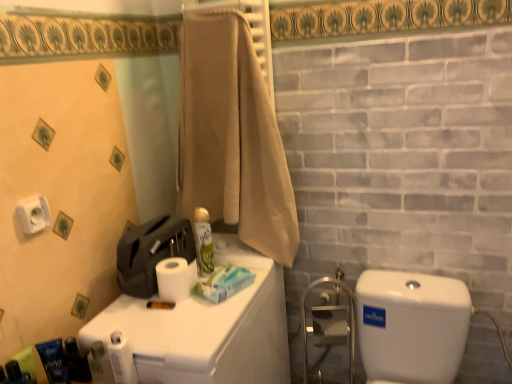
The image size is (512, 384). Identify the location of blue matte tube at lower left, the fourth toiletry from the right. (26, 361).

Where is `white plastic toilet tank at center`? This screenshot has height=384, width=512. white plastic toilet tank at center is located at coordinates (207, 330).

In order to click on white glossy water tank at right in this screenshot , I will do `click(411, 326)`.

Locate an element on the screen. white matte toilet paper at left, the 1th toilet paper when ordered from left to right is located at coordinates (x=34, y=215).

What do you see at coordinates (203, 242) in the screenshot? This screenshot has height=384, width=512. I see `green matte spray can at center, positioned as the fifth toiletry in front-to-back order` at bounding box center [203, 242].

The image size is (512, 384). Find the location of `blue matte tube at lower left, which is the 2th toiletry in left-to-right order`. blue matte tube at lower left, which is the 2th toiletry in left-to-right order is located at coordinates (26, 361).

From the image's perspective, which is below, blue matte tube at lower left, which is the 2th toiletry in left-to-right order, or white glossy water tank at right?

From the image's view, white glossy water tank at right is below.

Is blue matte tube at lower left, the 4th toiletry from the back, smaller than white glossy water tank at right?

Correct, blue matte tube at lower left, the 4th toiletry from the back, occupies less space than white glossy water tank at right.

The width and height of the screenshot is (512, 384). Find the location of `toiletry that is the 4th object to the left of the white glossy water tank at right, starting at the anchor`. toiletry that is the 4th object to the left of the white glossy water tank at right, starting at the anchor is located at coordinates (26, 361).

Can you tell me how much blue matte tube at lower left, the 4th toiletry from the back, and white glossy water tank at right differ in facing direction?

The angular difference between blue matte tube at lower left, the 4th toiletry from the back, and white glossy water tank at right is 89.4 degrees.

Is white glossy water tank at right at the right side of blue matte toiletry at lower left, acting as the third toiletry starting from the left?

Yes, white glossy water tank at right is to the right of blue matte toiletry at lower left, acting as the third toiletry starting from the left.

Looking at this image, what's the angular difference between white glossy water tank at right and blue matte toiletry at lower left, placed as the 3th toiletry when sorted from back to front,'s facing directions?

36.6 degrees.

From the image's perspective, would you say white glossy water tank at right is positioned over blue matte toiletry at lower left, placed as the 3th toiletry when sorted from back to front?

No, from the image's perspective, white glossy water tank at right is not on top of blue matte toiletry at lower left, placed as the 3th toiletry when sorted from back to front.

Could blue matte toiletry at lower left, placed as the 3th toiletry when sorted from back to front, be considered to be inside white glossy water tank at right?

No, blue matte toiletry at lower left, placed as the 3th toiletry when sorted from back to front, is not surrounded by white glossy water tank at right.

Are white matte toilet paper at lower left, placed as the second toilet paper when sorted from right to left, and metallic blue soap dispenser at lower left, the fourth toiletry in the left-to-right sequence, far apart?

No, there isn't a large distance between white matte toilet paper at lower left, placed as the second toilet paper when sorted from right to left, and metallic blue soap dispenser at lower left, the fourth toiletry in the left-to-right sequence.

Looking at this image, from a real-world perspective, is white matte toilet paper at lower left, the first toilet paper from the bottom, on top of metallic blue soap dispenser at lower left, the 2th toiletry when ordered from right to left?

Yes.

Is point (118, 339) in front of point (78, 379)?

Yes, it is.

Could you tell me if white matte toilet paper at left, the 2th toilet paper in the back-to-front sequence, is turned towards white matte toilet paper at upper center, which is the first toilet paper in right-to-left order?

No.

Which object is closer to the camera taking this photo, white matte toilet paper at left, arranged as the 3th toilet paper when ordered from the bottom, or white matte toilet paper at upper center, which appears as the third toilet paper when viewed from the front?

white matte toilet paper at left, arranged as the 3th toilet paper when ordered from the bottom, is in front.

From a real-world perspective, which object rests below the other?

In real-world perspective, white matte toilet paper at upper center, which appears as the third toilet paper when viewed from the front, is lower.

From the white matte toilet paper at upper center, placed as the second toilet paper when sorted from top to bottom, count 1st toilet papers forward and point to it. Please provide its 2D coordinates.

[(34, 215)]

Considering the sizes of objects blue matte tube at lower left, the fourth toiletry from the right, and blue matte toiletry at lower left, the 3th toiletry positioned from the front, in the image provided, who is shorter, blue matte tube at lower left, the fourth toiletry from the right, or blue matte toiletry at lower left, the 3th toiletry positioned from the front,?

blue matte tube at lower left, the fourth toiletry from the right, is shorter.

Between blue matte tube at lower left, positioned as the second toiletry in front-to-back order, and blue matte toiletry at lower left, the third toiletry when ordered from right to left, which one appears on the left side from the viewer's perspective?

blue matte tube at lower left, positioned as the second toiletry in front-to-back order.

Can you confirm if blue matte tube at lower left, positioned as the second toiletry in front-to-back order, is wider than blue matte toiletry at lower left, the third toiletry when ordered from right to left?

In fact, blue matte tube at lower left, positioned as the second toiletry in front-to-back order, might be narrower than blue matte toiletry at lower left, the third toiletry when ordered from right to left.

Choose the correct answer: Is blue matte tube at lower left, positioned as the second toiletry in front-to-back order, inside blue matte toiletry at lower left, placed as the 3th toiletry when sorted from back to front, or outside it?

blue matte tube at lower left, positioned as the second toiletry in front-to-back order, is outside blue matte toiletry at lower left, placed as the 3th toiletry when sorted from back to front.

In the scene shown: Considering the relative sizes of blue matte tube at lower left, positioned as the second toiletry in front-to-back order, and black plastic razor at lower left, the fifth toiletry positioned from the right, in the image provided, is blue matte tube at lower left, positioned as the second toiletry in front-to-back order, wider than black plastic razor at lower left, the fifth toiletry positioned from the right,?

Yes.

Between point (19, 366) and point (15, 383), which one is positioned in front?

Positioned in front is point (15, 383).

Is blue matte tube at lower left, the 4th toiletry from the back, not close to black plastic razor at lower left, marked as the 5th toiletry in a back-to-front arrangement?

No, there isn't a large distance between blue matte tube at lower left, the 4th toiletry from the back, and black plastic razor at lower left, marked as the 5th toiletry in a back-to-front arrangement.

Does white matte toilet paper at lower left, arranged as the third toilet paper when viewed from the back, appear on the left side of white plastic toilet tank at center?

Indeed, white matte toilet paper at lower left, arranged as the third toilet paper when viewed from the back, is positioned on the left side of white plastic toilet tank at center.

In terms of height, does white matte toilet paper at lower left, positioned as the second toilet paper in left-to-right order, look taller or shorter compared to white plastic toilet tank at center?

Considering their sizes, white matte toilet paper at lower left, positioned as the second toilet paper in left-to-right order, has less height than white plastic toilet tank at center.

From a real-world perspective, who is located higher, white matte toilet paper at lower left, placed as the second toilet paper when sorted from right to left, or white plastic toilet tank at center?

white matte toilet paper at lower left, placed as the second toilet paper when sorted from right to left.

Image resolution: width=512 pixels, height=384 pixels. In order to click on water tank below the blue matte tube at lower left, the 4th toiletry from the back (from the image's perspective) in this screenshot , I will do `click(411, 326)`.

In order to click on toiletry that is the 4th one above the white glossy water tank at right (from a real-world perspective) in this screenshot , I will do `click(54, 361)`.

Which object lies nearer to the anchor point beige cotton towel at upper center, blue matte tube at lower left, positioned as the second toiletry in front-to-back order, or white glossy water tank at right?

Based on the image, white glossy water tank at right appears to be nearer to beige cotton towel at upper center.

Which object lies further to the anchor point beige cotton towel at upper center, white matte toilet paper at upper center, which is the first toilet paper in right-to-left order, or green matte spray can at center, placed as the first toiletry when sorted from back to front?

white matte toilet paper at upper center, which is the first toilet paper in right-to-left order, is positioned further to the anchor beige cotton towel at upper center.

When comparing their distances from white matte toilet paper at upper center, which appears as the third toilet paper when viewed from the front, does white glossy water tank at right or black plastic razor at lower left, acting as the 1th toiletry starting from the front, seem further?

white glossy water tank at right.

Based on their spatial positions, is black plastic razor at lower left, acting as the 1th toiletry starting from the front, or green matte spray can at center, the fifth toiletry when ordered from left to right, closer to white matte toilet paper at lower left, arranged as the third toilet paper when viewed from the back?

black plastic razor at lower left, acting as the 1th toiletry starting from the front.

Considering their positions, is beige cotton towel at upper center positioned closer to white matte toilet paper at upper center, which is the first toilet paper in right-to-left order, than white plastic toilet tank at center?

The object closer to white matte toilet paper at upper center, which is the first toilet paper in right-to-left order, is white plastic toilet tank at center.

Looking at the image, which one is located closer to white matte toilet paper at lower left, the first toilet paper from the bottom, white glossy water tank at right or white matte toilet paper at upper center, positioned as the third toilet paper in left-to-right order?

The object closer to white matte toilet paper at lower left, the first toilet paper from the bottom, is white matte toilet paper at upper center, positioned as the third toilet paper in left-to-right order.

Based on their spatial positions, is black plastic razor at lower left, marked as the 5th toiletry in a back-to-front arrangement, or white matte toilet paper at upper center, positioned as the third toilet paper in left-to-right order, closer to white matte toilet paper at left, marked as the second toilet paper in a front-to-back arrangement?

black plastic razor at lower left, marked as the 5th toiletry in a back-to-front arrangement.

Looking at the image, which one is located closer to white matte toilet paper at upper center, which appears as the third toilet paper when viewed from the front, beige cotton towel at upper center or blue matte toiletry at lower left, the third toiletry when ordered from right to left?

blue matte toiletry at lower left, the third toiletry when ordered from right to left.

Where is `bath towel situated between black plastic razor at lower left, acting as the 1th toiletry starting from the front, and white glossy water tank at right from left to right`? The height and width of the screenshot is (384, 512). bath towel situated between black plastic razor at lower left, acting as the 1th toiletry starting from the front, and white glossy water tank at right from left to right is located at coordinates (232, 137).

The height and width of the screenshot is (384, 512). I want to click on water tank between beige cotton towel at upper center and white plastic toilet tank at center from top to bottom, so click(x=411, y=326).

I want to click on toilet paper between white matte toilet paper at lower left, which appears as the 1th toilet paper when viewed from the front, and white glossy water tank at right, so click(175, 278).

You are a GUI agent. You are given a task and a screenshot of the screen. Output one action in this format:
    pyautogui.click(x=<x>, y=<y>)
    Task: Click on the toiletry located between blue matte toiletry at lower left, placed as the 3th toiletry when sorted from back to front, and green matte spray can at center, which ranks as the first toiletry in right-to-left order, in the left-right direction
    Image resolution: width=512 pixels, height=384 pixels.
    Given the screenshot: What is the action you would take?
    pyautogui.click(x=77, y=361)